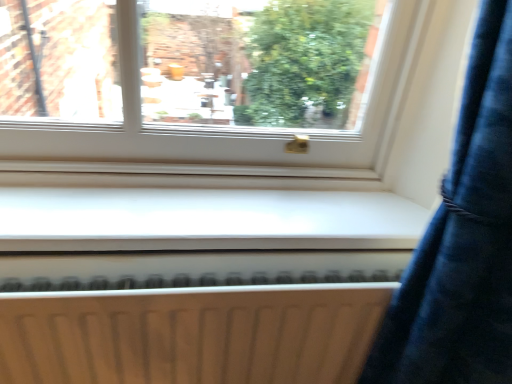
Where is `vacant area on top of white smooth window sill at center (from a real-world perspective)`? The image size is (512, 384). vacant area on top of white smooth window sill at center (from a real-world perspective) is located at coordinates (223, 201).